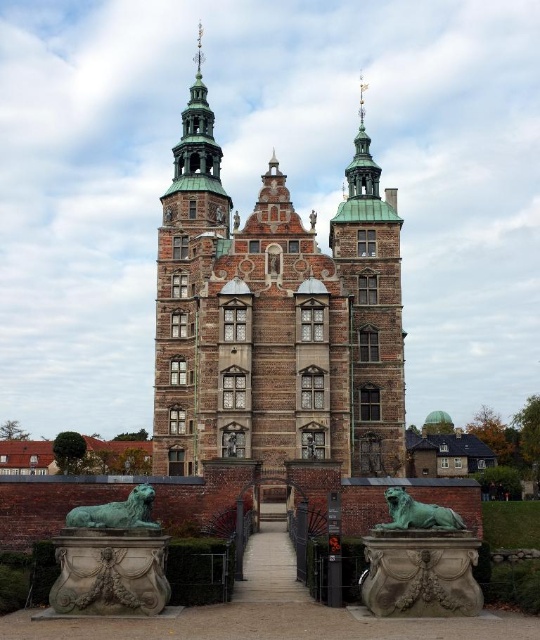
You are standing in a field 200 feet away from the historic building. You want to take a photo of the brown stone tower at center. Can you reach the tower within 50 feet to get a closer shot?

The brown stone tower at center and viewer are 247.81 feet apart from each other, so you are 247.81 feet away from the tower. Since you want to get within 50 feet, you need to move forward 197.81 feet to reach the desired distance.

You are standing in front of the grand historic building and notice the green patina stone lion at lower left. What are the coordinates of this lion relative to the building?

The green patina stone lion at lower left is located at coordinates point (117, 513).